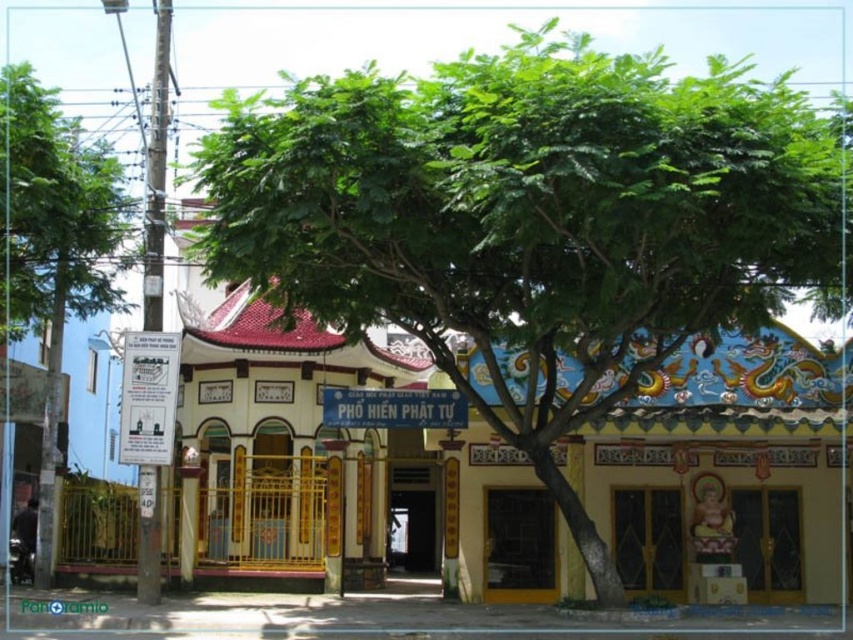
Can you confirm if green leafy tree at center is shorter than green leafy tree at left?

No, green leafy tree at center is not shorter than green leafy tree at left.

Between green leafy tree at center and green leafy tree at left, which one has more height?

green leafy tree at center is taller.

Does point (483, 225) lie in front of point (4, 196)?

Yes.

The height and width of the screenshot is (640, 853). I want to click on green leafy tree at center, so click(x=531, y=221).